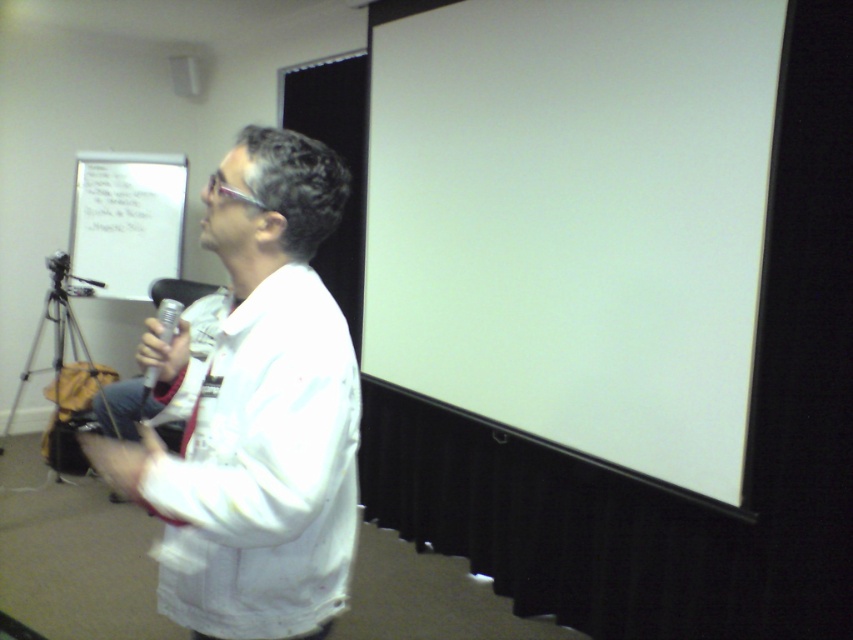
Question: Does white matte shirt at center appear under white paper at upper left?

Choices:
 (A) yes
 (B) no

Answer: (A)

Question: Does white matte projection screen at upper right appear under metallic silver microphone at center?

Choices:
 (A) yes
 (B) no

Answer: (B)

Question: Does white matte shirt at center have a smaller size compared to white paper at upper left?

Choices:
 (A) yes
 (B) no

Answer: (B)

Question: Which object is positioned closest to the white paper at upper left?

Choices:
 (A) metallic silver microphone at center
 (B) silver metallic tripod at lower left
 (C) white matte projection screen at upper right

Answer: (B)

Question: Which point appears farthest from the camera in this image?

Choices:
 (A) (97, 237)
 (B) (689, 97)

Answer: (A)

Question: Which of the following is the farthest from the observer?

Choices:
 (A) silver metallic tripod at lower left
 (B) white paper at upper left

Answer: (B)